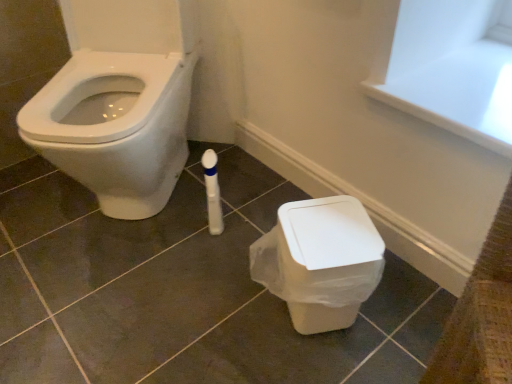
Locate an element on the screen. The height and width of the screenshot is (384, 512). empty space that is ontop of matte white tile at center is located at coordinates (149, 255).